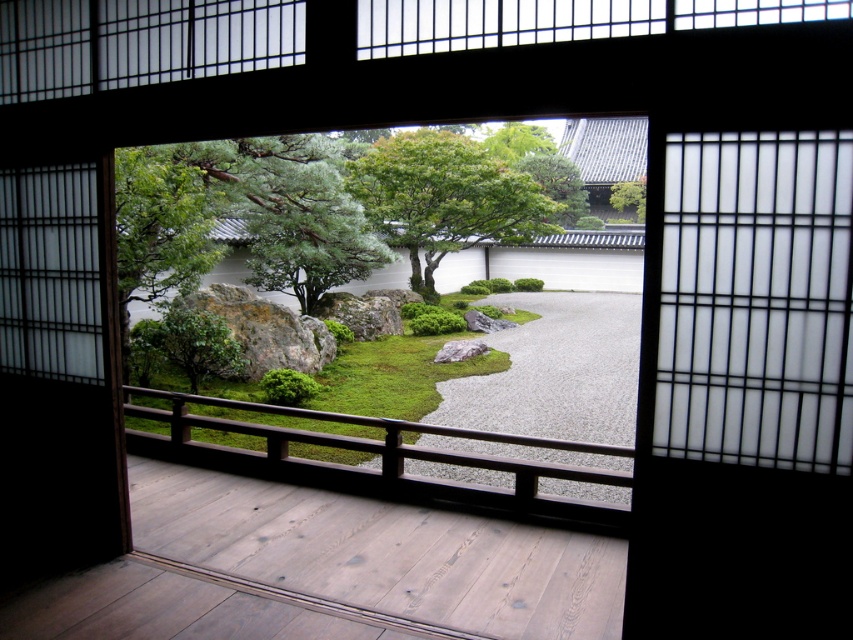
You are an interior designer assessing the space. You need to determine if the white translucent screen at upper right can be replaced with a wider version without exceeding the width of the white paper at left. Based on the scene, what is your recommendation?

The white translucent screen at upper right has a lesser width compared to white paper at left, so a wider version of the white translucent screen at upper right could be installed as long as it does not exceed the width of the white paper at left.